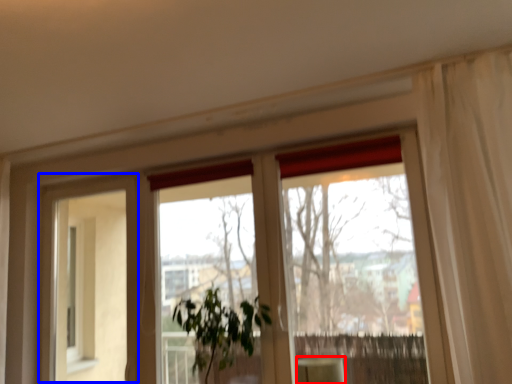
Question: Which object appears closest to the camera in this image, furniture (highlighted by a red box) or screen door (highlighted by a blue box)?

Choices:
 (A) furniture
 (B) screen door

Answer: (A)